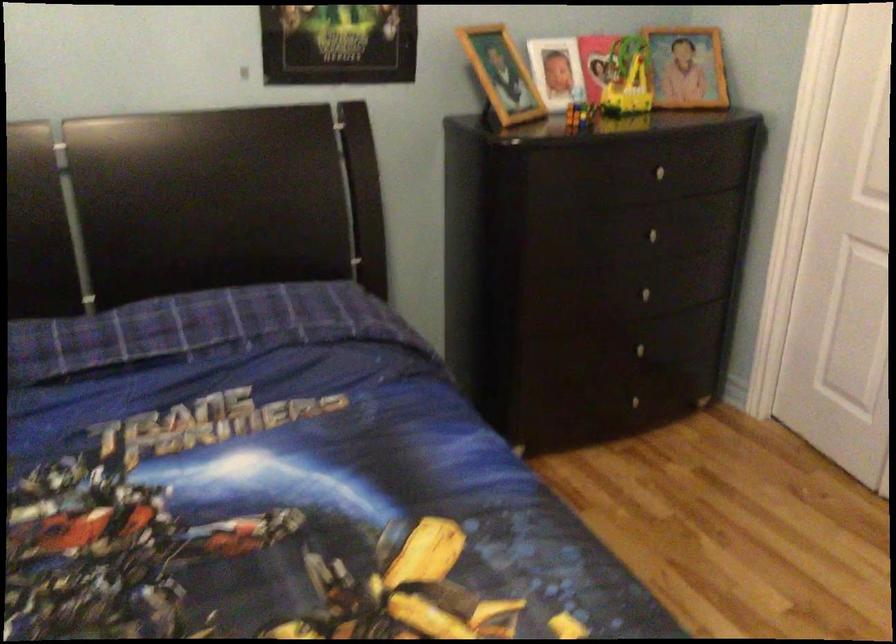
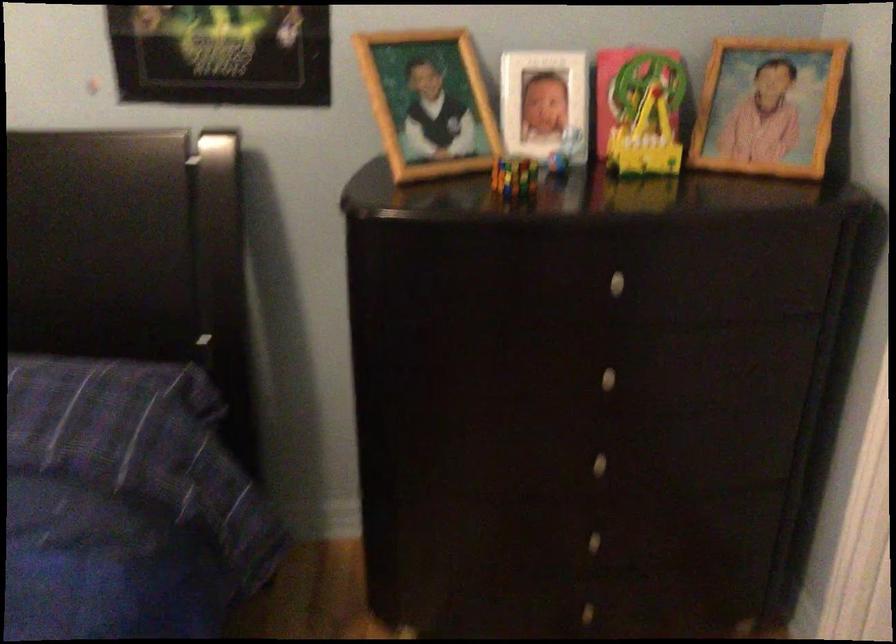
In a continuous first-person perspective shot, in which direction is the camera moving?

The cameraman moved toward right, forward.